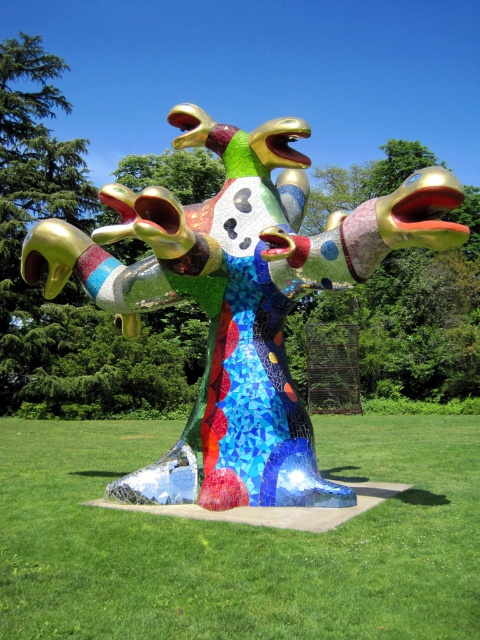
You are an artist planning to photograph the mosaic sculpture at center and the mosaic multicolored sculpture at center. Which one should you focus on if you want to capture the tallest sculpture in the scene?

The mosaic sculpture at center is much taller than the mosaic multicolored sculpture at center, so you should focus on the mosaic sculpture at center to capture the tallest sculpture in the scene.

You are standing in front of the vibrant mosaic sculpture and see two points marked on it. The first point is at coordinate point (126, 547) and the second is at point (427, 240). From your perspective, which point is closer to you?

Point (126, 547) is in front of point (427, 240), so the first point is closer to you.

You are standing in front of the mosaic sculpture at center. A tour guide asks you to locate a specific point on the sculpture. The point is given as coordinates point (x=240, y=541). Can you describe where this point is located on the sculpture?

The point (x=240, y=541) corresponds to the mosaic sculpture at center, so it is located on the sculpture itself.